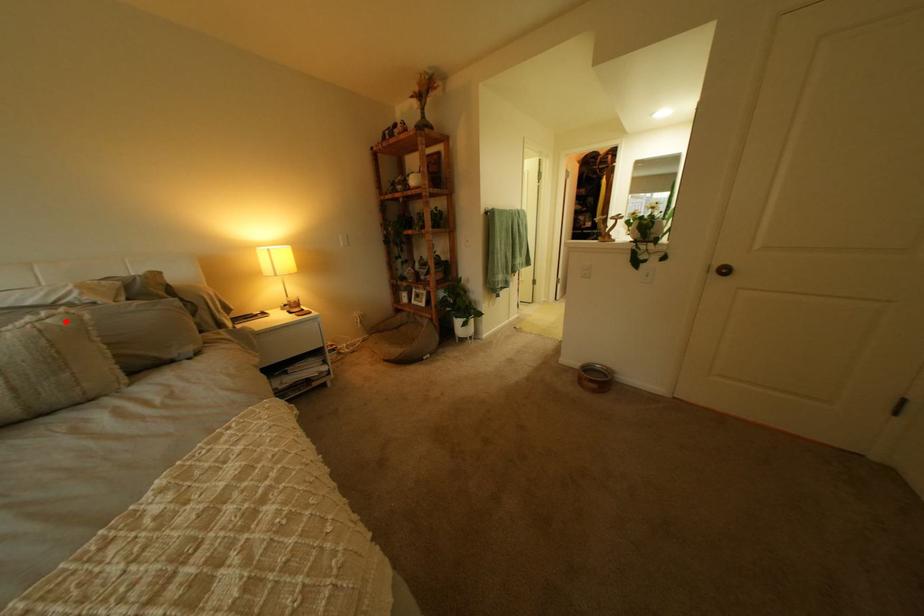
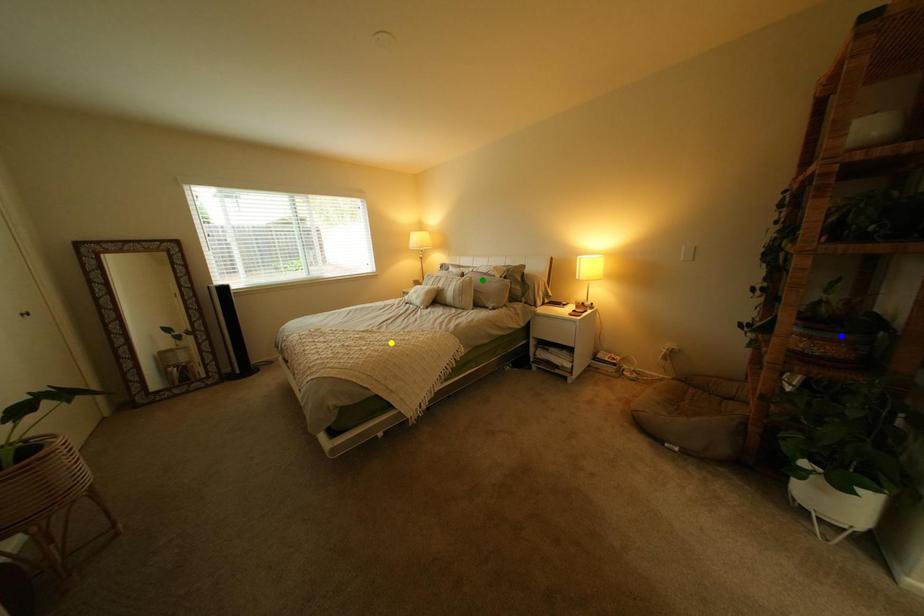
Question: I am providing you with two images of the same scene from different viewpoints. A red point is marked on the first image. You are given multiple points on the second image. Can you choose the point in image 2 that corresponds to the point in image 1?

Choices:
 (A) yellow point
 (B) blue point
 (C) green point

Answer: (C)